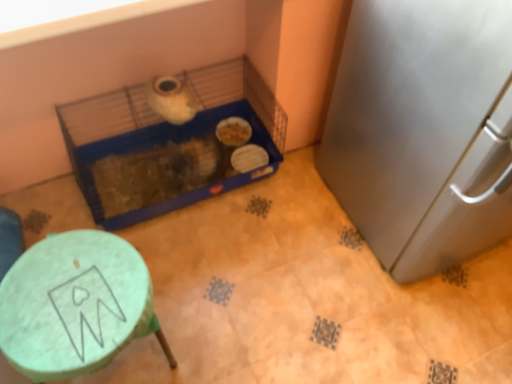
Question: From a real-world perspective, is green matte stool at lower left located beneath satin silver refrigerator at right?

Choices:
 (A) no
 (B) yes

Answer: (B)

Question: Would you say green matte stool at lower left is a long distance from satin silver refrigerator at right?

Choices:
 (A) no
 (B) yes

Answer: (A)

Question: Is green matte stool at lower left oriented towards satin silver refrigerator at right?

Choices:
 (A) no
 (B) yes

Answer: (B)

Question: Is green matte stool at lower left taller than satin silver refrigerator at right?

Choices:
 (A) no
 (B) yes

Answer: (A)

Question: From the image's perspective, is green matte stool at lower left located above satin silver refrigerator at right?

Choices:
 (A) yes
 (B) no

Answer: (B)

Question: Is green matte stool at lower left closer to camera compared to satin silver refrigerator at right?

Choices:
 (A) yes
 (B) no

Answer: (B)

Question: From a real-world perspective, is dark brown textured bedding at center located beneath satin silver refrigerator at right?

Choices:
 (A) yes
 (B) no

Answer: (A)

Question: Is dark brown textured bedding at center aimed at satin silver refrigerator at right?

Choices:
 (A) no
 (B) yes

Answer: (A)

Question: From the image's perspective, is dark brown textured bedding at center beneath satin silver refrigerator at right?

Choices:
 (A) no
 (B) yes

Answer: (B)

Question: Is dark brown textured bedding at center to the left of satin silver refrigerator at right from the viewer's perspective?

Choices:
 (A) no
 (B) yes

Answer: (B)

Question: Considering the relative positions of dark brown textured bedding at center and satin silver refrigerator at right in the image provided, is dark brown textured bedding at center to the right of satin silver refrigerator at right from the viewer's perspective?

Choices:
 (A) yes
 (B) no

Answer: (B)

Question: Considering the relative sizes of dark brown textured bedding at center and satin silver refrigerator at right in the image provided, is dark brown textured bedding at center wider than satin silver refrigerator at right?

Choices:
 (A) yes
 (B) no

Answer: (B)

Question: From a real-world perspective, is satin silver refrigerator at right physically above dark brown textured bedding at center?

Choices:
 (A) no
 (B) yes

Answer: (B)